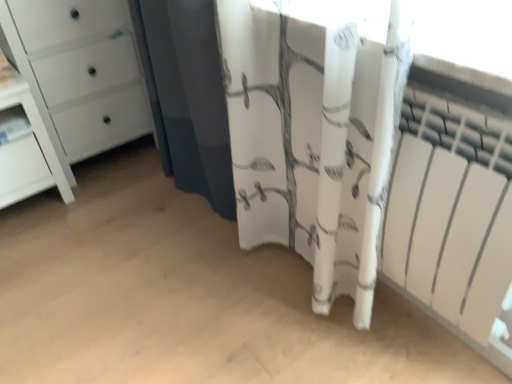
Where is `free space underneath white fabric curtain at center (from a real-world perspective)`? This screenshot has width=512, height=384. free space underneath white fabric curtain at center (from a real-world perspective) is located at coordinates (305, 283).